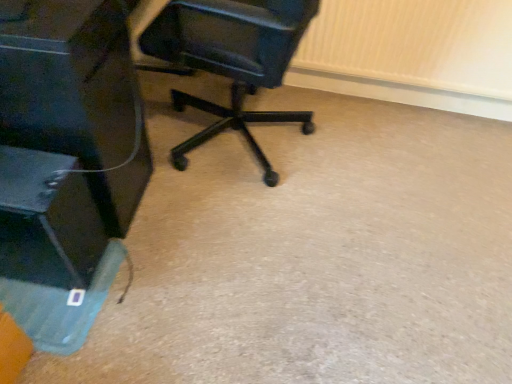
This screenshot has height=384, width=512. I want to click on vacant space underneath black plastic chair at center (from a real-world perspective), so click(246, 132).